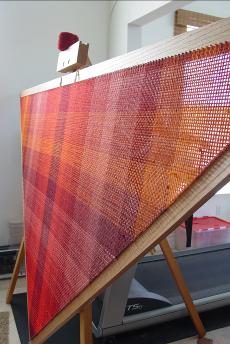
You are a GUI agent. You are given a task and a screenshot of the screen. Output one action in this format:
    pyautogui.click(x=<x>, y=<y>)
    Task: Click on the red plastic bin lid
    This screenshot has height=344, width=230.
    Given the screenshot: What is the action you would take?
    pyautogui.click(x=208, y=223)